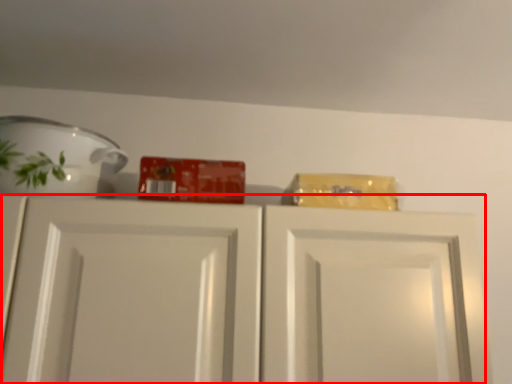
Question: From the image's perspective, where is cabinetry (annotated by the red box) located in relation to tableware in the image?

Choices:
 (A) below
 (B) above

Answer: (A)